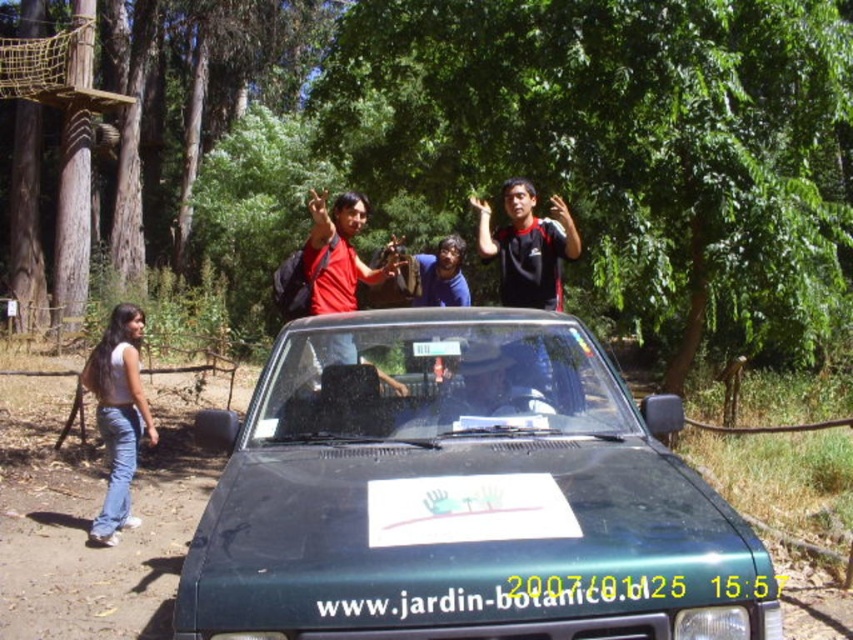
Question: Does matte red shirt at center have a greater width compared to white plastic license plate at center?

Choices:
 (A) no
 (B) yes

Answer: (B)

Question: Is green matte car at center wider than matte red shirt at center?

Choices:
 (A) no
 (B) yes

Answer: (A)

Question: Which object is the farthest from the matte red shirt at center?

Choices:
 (A) green matte car at center
 (B) denim jeans at left

Answer: (B)

Question: Among these objects, which one is farthest from the camera?

Choices:
 (A) white plastic license plate at center
 (B) matte red shirt at center

Answer: (A)

Question: Is matte red shirt at center further to the viewer compared to white plastic license plate at center?

Choices:
 (A) yes
 (B) no

Answer: (B)

Question: Which of the following is the farthest from the observer?

Choices:
 (A) (122, 385)
 (B) (492, 400)
 (C) (456, 348)
 (D) (384, 378)

Answer: (A)